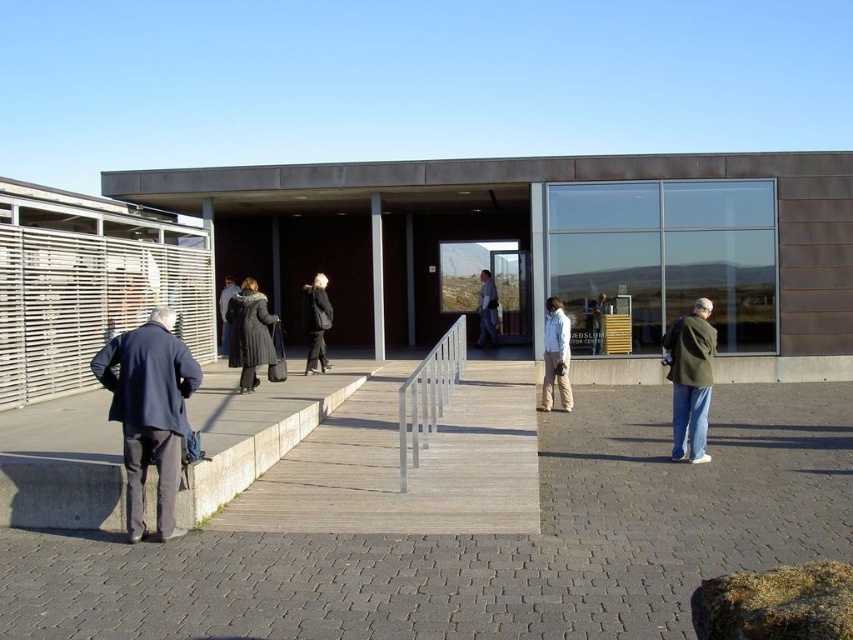
You are a photographer trying to capture a closeup of the dark gray fur coat at center without including the dark gray coat at center in the frame. Given their sizes, is this feasible?

The dark gray fur coat at center is smaller than the dark gray coat at center, so it is possible to frame the dark gray fur coat at center without including the larger dark gray coat at center if positioned correctly.

You are a photographer trying to capture a clear shot of the silver metallic rail at center without the dark blue coat at left blocking it. Based on their heights, which object should you adjust your camera angle to focus on, and why?

The dark blue coat at left is taller than the silver metallic rail at center. To avoid blocking the view of the silver metallic rail at center, adjust your camera angle to focus on the silver metallic rail at center since it is shorter and less likely to be obscured by the taller dark blue coat at left.

You are standing in front of the modern building and see a dark blue coat at left and a silver metallic rail at center. Which object is positioned further to the left?

The dark blue coat at left is positioned further to the left than the silver metallic rail at center.